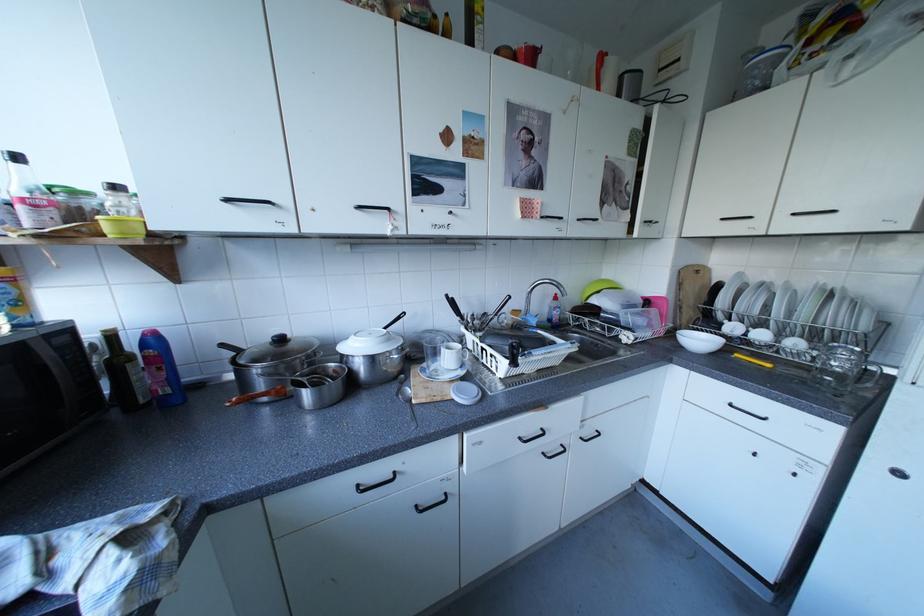
Find the location of `faucet handle`. faucet handle is located at coordinates (551, 313).